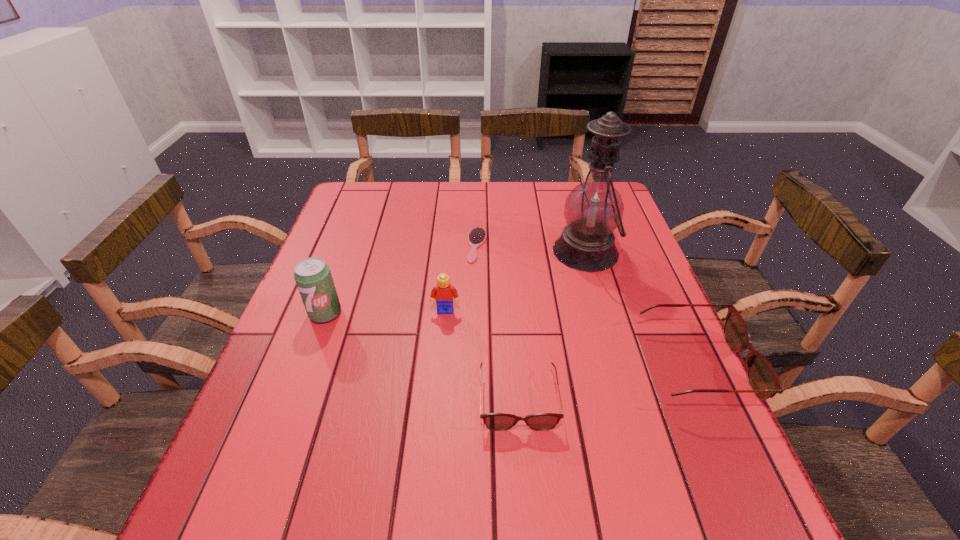
This screenshot has width=960, height=540. In the image, there is a desktop. In order to click on vacant space at the left edge in this screenshot , I will do `click(353, 231)`.

I want to click on blank space at the right edge of the desktop, so click(x=661, y=347).

Identify the location of vacant space at the far left corner. (382, 190).

Locate an element on the screen. free space between the tallest object and the leftmost object is located at coordinates (455, 282).

The image size is (960, 540). What are the coordinates of `empty space between the fifth object from right to left and the hairbrush` in the screenshot? It's located at (462, 278).

Locate an element on the screen. This screenshot has width=960, height=540. vacant space that's between the hairbrush and the second object from left to right is located at coordinates (462, 278).

Locate an element on the screen. The height and width of the screenshot is (540, 960). blank region between the left spectacles and the shortest object is located at coordinates (497, 323).

Locate an element on the screen. This screenshot has height=540, width=960. free area in between the fifth tallest object and the Lego is located at coordinates (482, 355).

Image resolution: width=960 pixels, height=540 pixels. I want to click on vacant space that's between the third shortest object and the leftmost object, so click(510, 340).

At what (x,y) coordinates should I click in order to perform the action: click on empty space that is in between the third shortest object and the Lego. Please return your answer as a coordinate pair (x, y). This screenshot has width=960, height=540. Looking at the image, I should click on (570, 339).